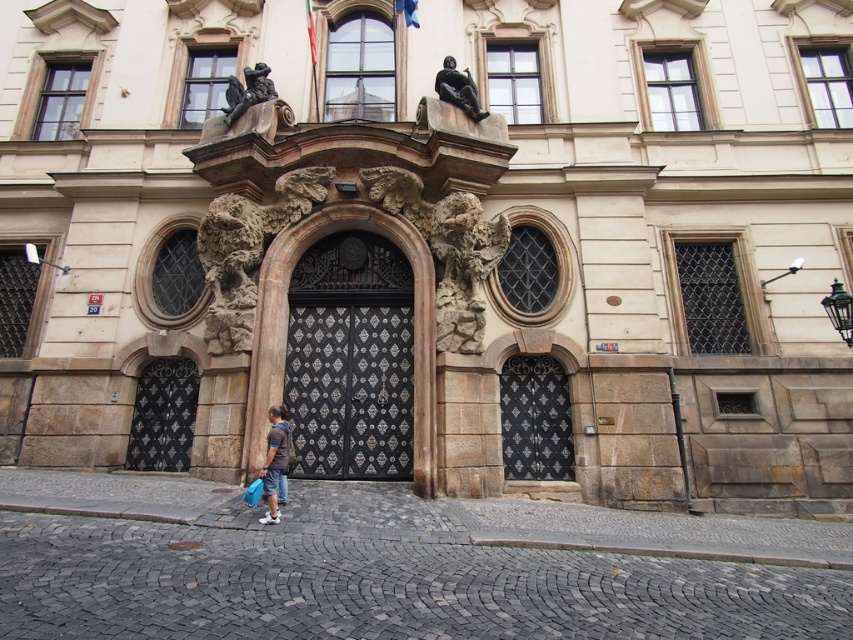
Which is in front, point (254, 100) or point (456, 97)?

Positioned in front is point (456, 97).

From the picture: Is dark gray stone statue at upper center smaller than polished bronze statue at upper center?

Incorrect, dark gray stone statue at upper center is not smaller in size than polished bronze statue at upper center.

Between point (259, 65) and point (474, 116), which one is positioned behind?

Positioned behind is point (259, 65).

I want to click on dark gray stone statue at upper center, so click(247, 92).

Is dark blue shirt at center shorter than polished bronze statue at upper center?

Yes.

Is dark blue shirt at center above polished bronze statue at upper center?

No.

Who is more distant from viewer, (277, 419) or (466, 70)?

Positioned behind is point (466, 70).

Identify the location of dark blue shirt at center. This screenshot has height=640, width=853. (274, 460).

Can you confirm if dark blue shirt at center is wider than dark gray stone statue at upper center?

In fact, dark blue shirt at center might be narrower than dark gray stone statue at upper center.

Which is below, dark blue shirt at center or dark gray stone statue at upper center?

dark blue shirt at center is lower down.

The width and height of the screenshot is (853, 640). What do you see at coordinates (274, 460) in the screenshot?
I see `dark blue shirt at center` at bounding box center [274, 460].

At what (x,y) coordinates should I click in order to perform the action: click on dark blue shirt at center. Please return your answer as a coordinate pair (x, y). Looking at the image, I should click on (274, 460).